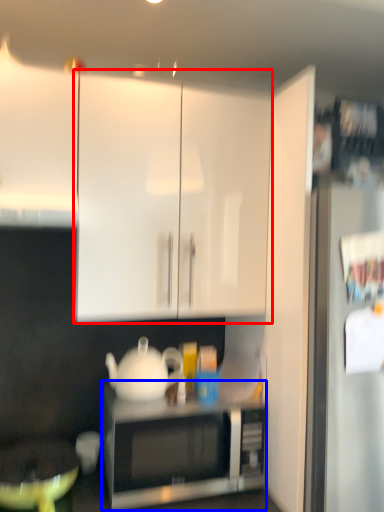
Question: Which object is further to the camera taking this photo, cabinetry (highlighted by a red box) or microwave oven (highlighted by a blue box)?

Choices:
 (A) cabinetry
 (B) microwave oven

Answer: (B)